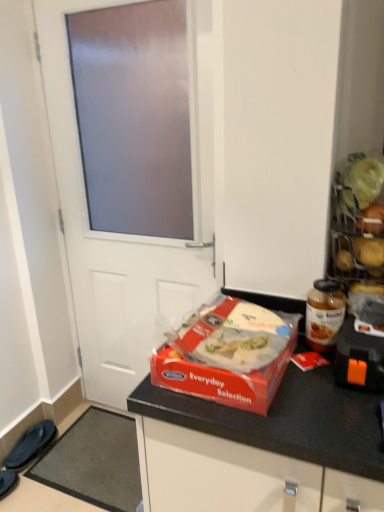
Question: Does red matte plastic box of food at center have a larger size compared to translucent glass jar at right?

Choices:
 (A) no
 (B) yes

Answer: (B)

Question: Is red matte plastic box of food at center placed right next to translucent glass jar at right?

Choices:
 (A) yes
 (B) no

Answer: (B)

Question: From the image's perspective, is red matte plastic box of food at center located above translucent glass jar at right?

Choices:
 (A) no
 (B) yes

Answer: (A)

Question: From the image's perspective, is red matte plastic box of food at center under translucent glass jar at right?

Choices:
 (A) no
 (B) yes

Answer: (B)

Question: Considering the relative sizes of red matte plastic box of food at center and translucent glass jar at right in the image provided, is red matte plastic box of food at center wider than translucent glass jar at right?

Choices:
 (A) no
 (B) yes

Answer: (B)

Question: Does red matte plastic box of food at center have a smaller size compared to translucent glass jar at right?

Choices:
 (A) no
 (B) yes

Answer: (A)

Question: Is the surface of white matte door at center in direct contact with red matte plastic box of food at center?

Choices:
 (A) yes
 (B) no

Answer: (B)

Question: Would you say white matte door at center is outside red matte plastic box of food at center?

Choices:
 (A) yes
 (B) no

Answer: (A)

Question: Is white matte door at center taller than red matte plastic box of food at center?

Choices:
 (A) yes
 (B) no

Answer: (A)

Question: Considering the relative sizes of white matte door at center and red matte plastic box of food at center in the image provided, is white matte door at center thinner than red matte plastic box of food at center?

Choices:
 (A) yes
 (B) no

Answer: (A)

Question: Is white matte door at center far from red matte plastic box of food at center?

Choices:
 (A) yes
 (B) no

Answer: (B)

Question: From the image's perspective, would you say white matte door at center is positioned over red matte plastic box of food at center?

Choices:
 (A) no
 (B) yes

Answer: (B)

Question: From the image's perspective, is red matte plastic box of food at center on black fabric slipper at lower left, the first footwear when ordered from back to front?

Choices:
 (A) yes
 (B) no

Answer: (A)